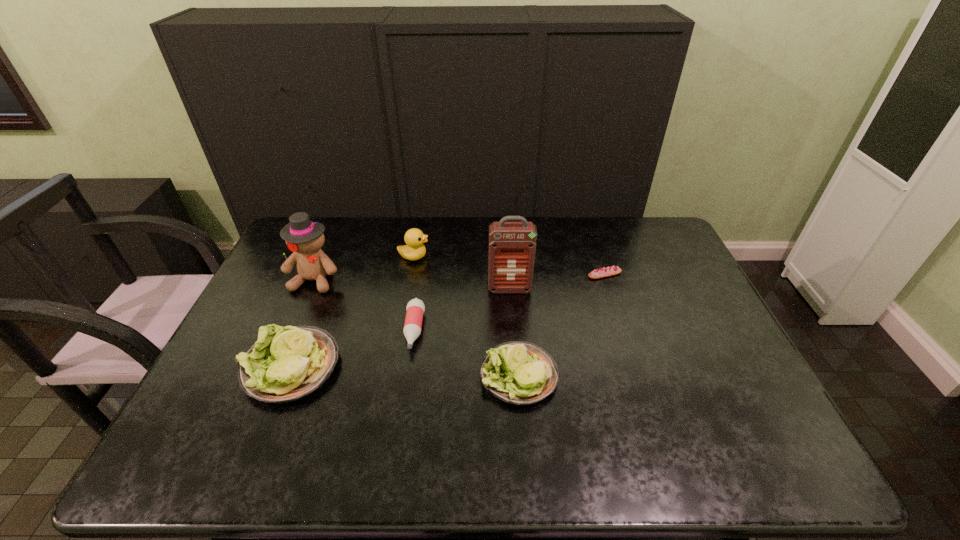
Where is `the left lettuce`? The image size is (960, 540). the left lettuce is located at coordinates (284, 365).

This screenshot has height=540, width=960. What are the coordinates of `the fourth shortest object` in the screenshot? It's located at (284, 365).

The width and height of the screenshot is (960, 540). Find the location of `the shorter lettuce`. the shorter lettuce is located at coordinates (521, 373).

Image resolution: width=960 pixels, height=540 pixels. In order to click on the right lettuce in this screenshot , I will do `click(521, 373)`.

Where is `the farthest object`? the farthest object is located at coordinates (414, 238).

Find the location of a particular element. This screenshot has width=960, height=540. duck is located at coordinates (414, 238).

Locate an element on the screen. The image size is (960, 540). the tallest object is located at coordinates (512, 245).

Identify the location of the rightmost object. (614, 270).

Where is `eclair`? Image resolution: width=960 pixels, height=540 pixels. eclair is located at coordinates (614, 270).

This screenshot has width=960, height=540. In order to click on rag_doll in this screenshot , I will do coord(304,238).